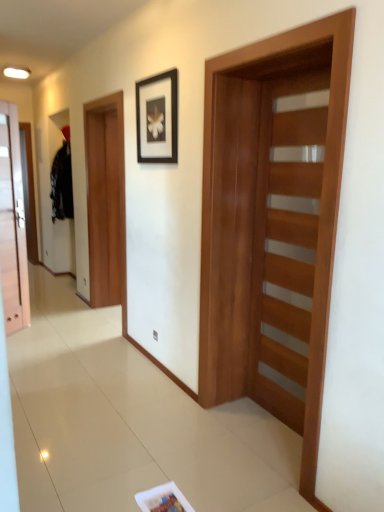
Measure the distance between matte wood door at left, arranged as the 2th door when viewed from the front, and camera.

The depth of matte wood door at left, arranged as the 2th door when viewed from the front, is 11.51 feet.

This screenshot has width=384, height=512. Find the location of `brown wooden door at left, arranged as the 2th barn door when viewed from the right`. brown wooden door at left, arranged as the 2th barn door when viewed from the right is located at coordinates (106, 199).

What are the coordinates of `white glossy magazine at lower center` in the screenshot? It's located at (163, 499).

Does black matte picture frame at upper center have a greater width compared to brown wooden door at left, which is counted as the 1th barn door, starting from the back?

In fact, black matte picture frame at upper center might be narrower than brown wooden door at left, which is counted as the 1th barn door, starting from the back.

Which object is further away from the camera, black matte picture frame at upper center or brown wooden door at left, the 2th barn door viewed from the front?

Positioned behind is brown wooden door at left, the 2th barn door viewed from the front.

In terms of size, does black matte picture frame at upper center appear bigger or smaller than brown wooden door at left, the 1th barn door in the left-to-right sequence?

Clearly, black matte picture frame at upper center is smaller in size than brown wooden door at left, the 1th barn door in the left-to-right sequence.

Looking at this image, from the image's perspective, would you say wooden door at right, the 2th door positioned from the back, is shown under matte wood door at left, arranged as the 2th door when viewed from the front?

Yes.

The width and height of the screenshot is (384, 512). Find the location of `door in front of the matte wood door at left, arranged as the 2th door when viewed from the front`. door in front of the matte wood door at left, arranged as the 2th door when viewed from the front is located at coordinates (286, 247).

Looking at this image, which point is more forward, (x=293, y=213) or (x=11, y=298)?

Positioned in front is point (x=293, y=213).

Can you confirm if wooden door at right, marked as the 1th door in a right-to-left arrangement, is smaller than matte wood door at left, which ranks as the 1th door in back-to-front order?

Yes, wooden door at right, marked as the 1th door in a right-to-left arrangement, is smaller than matte wood door at left, which ranks as the 1th door in back-to-front order.

Considering their positions, is wooden door at right, the first door positioned from the front, located in front of or behind black matte picture frame at upper center?

Clearly, wooden door at right, the first door positioned from the front, is in front of black matte picture frame at upper center.

You are a GUI agent. You are given a task and a screenshot of the screen. Output one action in this format:
    pyautogui.click(x=<x>, y=<y>)
    Task: Click on the picture frame that appears behind the wooden door at right, the 2th door when ordered from left to right
    This screenshot has width=384, height=512.
    Given the screenshot: What is the action you would take?
    pyautogui.click(x=157, y=118)

From the image's perspective, is wooden door at right, the 2th door positioned from the back, below black matte picture frame at upper center?

Yes, from the image's perspective, wooden door at right, the 2th door positioned from the back, is beneath black matte picture frame at upper center.

Looking at this image, from a real-world perspective, is wooden door at right, the 2th door positioned from the back, physically located above or below black matte picture frame at upper center?

wooden door at right, the 2th door positioned from the back, is below black matte picture frame at upper center.

Is white glossy magazine at lower center oriented away from wooden barn door at center, acting as the 1th barn door starting from the front?

white glossy magazine at lower center is not turned away from wooden barn door at center, acting as the 1th barn door starting from the front.

Does point (150, 505) appear closer or farther from the camera than point (322, 390)?

Point (150, 505) is positioned farther from the camera compared to point (322, 390).

Is white glossy magazine at lower center to the left or to the right of wooden barn door at center, acting as the 1th barn door starting from the front, in the image?

In the image, white glossy magazine at lower center appears on the left side of wooden barn door at center, acting as the 1th barn door starting from the front.

From the image's perspective, which is above, brown wooden door at left, which is counted as the 1th barn door, starting from the back, or matte wood door at left, arranged as the 2th door when viewed from the front?

brown wooden door at left, which is counted as the 1th barn door, starting from the back, is shown above in the image.

Does point (90, 234) come behind point (19, 161)?

Yes, point (90, 234) is behind point (19, 161).

Does brown wooden door at left, arranged as the 2th barn door when viewed from the right, have a smaller size compared to matte wood door at left, which ranks as the 1th door in back-to-front order?

Incorrect, brown wooden door at left, arranged as the 2th barn door when viewed from the right, is not smaller in size than matte wood door at left, which ranks as the 1th door in back-to-front order.

From the picture: Is brown wooden door at left, the 2th barn door viewed from the front, not near matte wood door at left, which is counted as the 1th door, starting from the left?

No, there isn't a large distance between brown wooden door at left, the 2th barn door viewed from the front, and matte wood door at left, which is counted as the 1th door, starting from the left.

Does point (113, 242) lie behind point (271, 391)?

Yes.

Does brown wooden door at left, which is counted as the 1th barn door, starting from the back, have a smaller size compared to wooden barn door at center, which appears as the second barn door when viewed from the left?

No.

Could you tell me if brown wooden door at left, the 2th barn door viewed from the front, is turned towards wooden barn door at center, which ranks as the first barn door in right-to-left order?

No.

Is brown wooden door at left, the 2th barn door viewed from the front, next to wooden barn door at center, which appears as the second barn door when viewed from the left, and touching it?

No.

Between wooden barn door at center, which appears as the second barn door when viewed from the left, and wooden door at right, marked as the 1th door in a right-to-left arrangement, which one has smaller size?

With smaller size is wooden door at right, marked as the 1th door in a right-to-left arrangement.

How many degrees apart are the facing directions of wooden barn door at center, acting as the second barn door starting from the back, and wooden door at right, the first door positioned from the front?

0.458 degrees separate the facing orientations of wooden barn door at center, acting as the second barn door starting from the back, and wooden door at right, the first door positioned from the front.

Where is `door located below the wooden barn door at center, acting as the 1th barn door starting from the front (from the image's perspective)`? Image resolution: width=384 pixels, height=512 pixels. door located below the wooden barn door at center, acting as the 1th barn door starting from the front (from the image's perspective) is located at coordinates (286, 247).

From a real-world perspective, which object rests below the other?

wooden door at right, the 2th door when ordered from left to right, is physically lower.

This screenshot has width=384, height=512. Identify the location of barn door that is behind the black matte picture frame at upper center. (106, 199).

This screenshot has height=512, width=384. I want to click on door to the right of matte wood door at left, placed as the second door when sorted from right to left, so click(286, 247).

From the picture: Estimate the real-world distances between objects in this image. Which object is closer to wooden door at right, the first door positioned from the front, brown wooden door at left, which is counted as the 1th barn door, starting from the back, or matte wood door at left, which is counted as the 1th door, starting from the left?

Among the two, brown wooden door at left, which is counted as the 1th barn door, starting from the back, is located nearer to wooden door at right, the first door positioned from the front.

Based on their spatial positions, is matte wood door at left, arranged as the 2th door when viewed from the front, or wooden barn door at center, which ranks as the first barn door in right-to-left order, further from black matte picture frame at upper center?

Based on the image, matte wood door at left, arranged as the 2th door when viewed from the front, appears to be further to black matte picture frame at upper center.

From the image, which object appears to be nearer to wooden barn door at center, which ranks as the first barn door in right-to-left order, black matte picture frame at upper center or wooden door at right, the first door positioned from the front?

wooden door at right, the first door positioned from the front.

Based on their spatial positions, is white glossy magazine at lower center or brown wooden door at left, which is counted as the 1th barn door, starting from the back, further from black matte picture frame at upper center?

white glossy magazine at lower center lies further to black matte picture frame at upper center than the other object.

Based on their spatial positions, is wooden door at right, the first door positioned from the front, or white glossy magazine at lower center closer to matte wood door at left, arranged as the 2th door when viewed from the front?

wooden door at right, the first door positioned from the front, is positioned closer to the anchor matte wood door at left, arranged as the 2th door when viewed from the front.

When comparing their distances from black matte picture frame at upper center, does wooden door at right, the first door positioned from the front, or brown wooden door at left, which is counted as the 1th barn door, starting from the back, seem further?

Among the two, brown wooden door at left, which is counted as the 1th barn door, starting from the back, is located further to black matte picture frame at upper center.

Looking at this image, which object lies nearer to the anchor point brown wooden door at left, arranged as the 2th barn door when viewed from the right, wooden door at right, marked as the 1th door in a right-to-left arrangement, or wooden barn door at center, which appears as the second barn door when viewed from the left?

wooden barn door at center, which appears as the second barn door when viewed from the left, is positioned closer to the anchor brown wooden door at left, arranged as the 2th barn door when viewed from the right.

Looking at the image, which one is located further to black matte picture frame at upper center, wooden door at right, marked as the 1th door in a right-to-left arrangement, or white glossy magazine at lower center?

white glossy magazine at lower center.

Locate an element on the screen. The width and height of the screenshot is (384, 512). door that lies between wooden barn door at center, which ranks as the first barn door in right-to-left order, and white glossy magazine at lower center from top to bottom is located at coordinates (286, 247).

Where is `magazine between matte wood door at left, which is counted as the 1th door, starting from the left, and wooden barn door at center, which appears as the second barn door when viewed from the left, from left to right`? This screenshot has height=512, width=384. magazine between matte wood door at left, which is counted as the 1th door, starting from the left, and wooden barn door at center, which appears as the second barn door when viewed from the left, from left to right is located at coordinates (163, 499).

Where is `magazine between wooden barn door at center, which appears as the second barn door when viewed from the left, and brown wooden door at left, the 2th barn door viewed from the front, along the z-axis`? magazine between wooden barn door at center, which appears as the second barn door when viewed from the left, and brown wooden door at left, the 2th barn door viewed from the front, along the z-axis is located at coordinates (163, 499).

Image resolution: width=384 pixels, height=512 pixels. What are the coordinates of `picture frame positioned between wooden door at right, the 2th door positioned from the back, and brown wooden door at left, the 1th barn door in the left-to-right sequence, from near to far` in the screenshot? It's located at (157, 118).